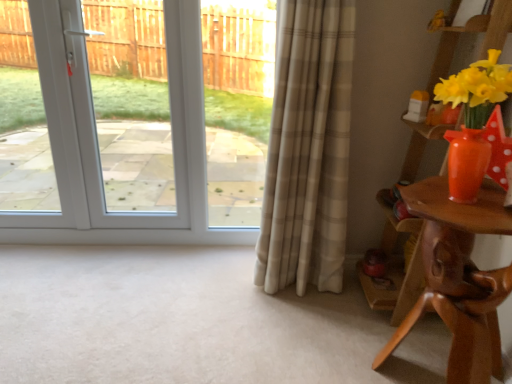
Where is `beige plaid curtain at center`? This screenshot has width=512, height=384. beige plaid curtain at center is located at coordinates (308, 148).

Image resolution: width=512 pixels, height=384 pixels. I want to click on matte orange vase at right, so click(473, 122).

I want to click on beige plaid curtain at center, so click(308, 148).

Considering the points (489, 89) and (134, 212), which point is in front, point (489, 89) or point (134, 212)?

The point (489, 89) is closer to the camera.

Is matte orange vase at right directly adjacent to white glossy door at upper left?

No, matte orange vase at right is not touching white glossy door at upper left.

Is white glossy door at upper left a part of matte orange vase at right?

No, white glossy door at upper left is not inside matte orange vase at right.

Is matte orange vase at right facing towards white glossy door at upper left?

No.

Is beige plaid curtain at center wider or thinner than brown wooden table at right?

Considering their sizes, beige plaid curtain at center looks slimmer than brown wooden table at right.

Is point (347, 86) more distant than point (439, 307)?

Yes, point (347, 86) is farther from viewer.

Measure the distance between beige plaid curtain at center and brown wooden table at right.

58.79 centimeters.

Between beige plaid curtain at center and brown wooden table at right, which one has less height?

brown wooden table at right is shorter.

Is brown wooden table at right far from beige plaid curtain at center?

No, brown wooden table at right is not far from beige plaid curtain at center.

Is brown wooden table at right closer to camera compared to beige plaid curtain at center?

Yes, brown wooden table at right is closer to the viewer.

Which is more to the left, brown wooden table at right or beige plaid curtain at center?

From the viewer's perspective, beige plaid curtain at center appears more on the left side.

From a real-world perspective, relative to beige plaid curtain at center, is brown wooden table at right vertically above or below?

From a real-world perspective, brown wooden table at right is physically below beige plaid curtain at center.

Considering the points (475, 346) and (465, 190), which point is behind, point (475, 346) or point (465, 190)?

Positioned behind is point (475, 346).

Are brown wooden table at right and matte orange vase at right beside each other?

No, brown wooden table at right is not touching matte orange vase at right.

Would you say brown wooden table at right is outside matte orange vase at right?

Indeed, brown wooden table at right is completely outside matte orange vase at right.

Which object is thinner, brown wooden table at right or matte orange vase at right?

matte orange vase at right.

Which of these two, brown wooden table at right or white glossy door at upper left, is thinner?

Thinner between the two is white glossy door at upper left.

Which object is closer to the camera taking this photo, brown wooden table at right or white glossy door at upper left?

Positioned in front is brown wooden table at right.

How distant is brown wooden table at right from white glossy door at upper left?

brown wooden table at right and white glossy door at upper left are 2.65 meters apart from each other.

Where is `table on the right of white glossy door at upper left`? The image size is (512, 384). table on the right of white glossy door at upper left is located at coordinates (459, 277).

Is white glossy door at upper left taller than beige plaid curtain at center?

Yes, white glossy door at upper left is taller than beige plaid curtain at center.

Is point (55, 119) positioned behind point (297, 67)?

Yes, it is.

Is white glossy door at upper left oriented away from beige plaid curtain at center?

white glossy door at upper left is not turned away from beige plaid curtain at center.

From the image's perspective, is white glossy door at upper left located beneath beige plaid curtain at center?

No, from the image's perspective, white glossy door at upper left is not below beige plaid curtain at center.

From a real-world perspective, between beige plaid curtain at center and white glossy door at upper left, who is vertically lower?

beige plaid curtain at center.

The image size is (512, 384). I want to click on door that is on the left side of beige plaid curtain at center, so 133,136.

Can we say beige plaid curtain at center lies outside white glossy door at upper left?

beige plaid curtain at center lies outside white glossy door at upper left's area.

From their relative heights in the image, would you say beige plaid curtain at center is taller or shorter than white glossy door at upper left?

Clearly, beige plaid curtain at center is shorter compared to white glossy door at upper left.

Where is `floral arrangement in front of the white glossy door at upper left`? floral arrangement in front of the white glossy door at upper left is located at coordinates (473, 122).

At what (x,y) coordinates should I click in order to perform the action: click on curtain that appears above the brown wooden table at right (from the image's perspective). Please return your answer as a coordinate pair (x, y). The height and width of the screenshot is (384, 512). Looking at the image, I should click on (308, 148).

When comparing their distances from beige plaid curtain at center, does brown wooden table at right or matte orange vase at right seem closer?

brown wooden table at right.

From the image, which object appears to be nearer to white glossy door at upper left, matte orange vase at right or brown wooden table at right?

brown wooden table at right.

From the image, which object appears to be farther from brown wooden table at right, white glossy door at upper left or matte orange vase at right?

Based on the image, white glossy door at upper left appears to be further to brown wooden table at right.

When comparing their distances from brown wooden table at right, does white glossy door at upper left or beige plaid curtain at center seem closer?

beige plaid curtain at center lies closer to brown wooden table at right than the other object.

Considering their positions, is brown wooden table at right positioned further to matte orange vase at right than white glossy door at upper left?

white glossy door at upper left is positioned further to the anchor matte orange vase at right.

When comparing their distances from brown wooden table at right, does beige plaid curtain at center or matte orange vase at right seem further?

beige plaid curtain at center lies further to brown wooden table at right than the other object.

When comparing their distances from matte orange vase at right, does brown wooden table at right or beige plaid curtain at center seem closer?

brown wooden table at right.

Estimate the real-world distances between objects in this image. Which object is further from white glossy door at upper left, matte orange vase at right or beige plaid curtain at center?

matte orange vase at right is further to white glossy door at upper left.

At what (x,y) coordinates should I click in order to perform the action: click on floral arrangement between white glossy door at upper left and brown wooden table at right. Please return your answer as a coordinate pair (x, y). Image resolution: width=512 pixels, height=384 pixels. Looking at the image, I should click on (473, 122).

Identify the location of curtain between white glossy door at upper left and matte orange vase at right in the horizontal direction. (308, 148).

Find the location of a particular element. The image size is (512, 384). curtain located between white glossy door at upper left and brown wooden table at right in the left-right direction is located at coordinates (308, 148).

At what (x,y) coordinates should I click in order to perform the action: click on curtain between matte orange vase at right and brown wooden table at right in the vertical direction. Please return your answer as a coordinate pair (x, y). The width and height of the screenshot is (512, 384). Looking at the image, I should click on (308, 148).